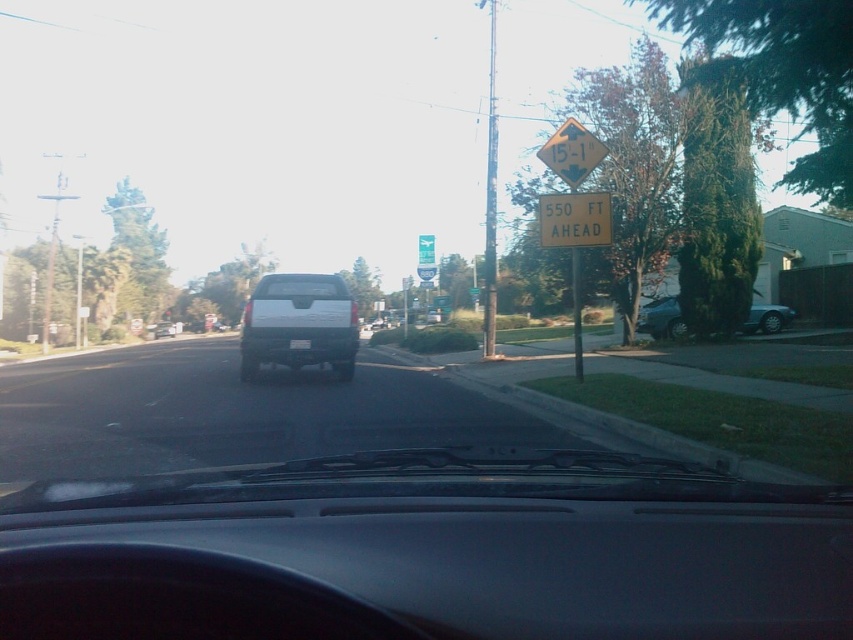
Question: Considering the relative positions of white matte suv at center and green plastic sign at center in the image provided, where is white matte suv at center located with respect to green plastic sign at center?

Choices:
 (A) left
 (B) right

Answer: (A)

Question: Is silver metallic sedan at right closer to camera compared to yellow reflective diamond-shaped sign at upper right?

Choices:
 (A) yes
 (B) no

Answer: (B)

Question: Which point is farther from the camera taking this photo?

Choices:
 (A) (427, 317)
 (B) (489, 8)
 (C) (434, 257)
 (D) (547, 243)

Answer: (B)

Question: Which point is farther to the camera?

Choices:
 (A) silver metallic sedan at right
 (B) yellow reflective plastic sign at upper right
 (C) yellow plastic sign at upper center

Answer: (C)

Question: Based on their relative distances, which object is nearer to the white matte suv at center?

Choices:
 (A) silver metallic sedan at right
 (B) white matte truck at center
 (C) green plastic sign at center
 (D) metallic pole at center

Answer: (A)

Question: Is white matte suv at center closer to the viewer compared to metallic pole at center?

Choices:
 (A) no
 (B) yes

Answer: (B)